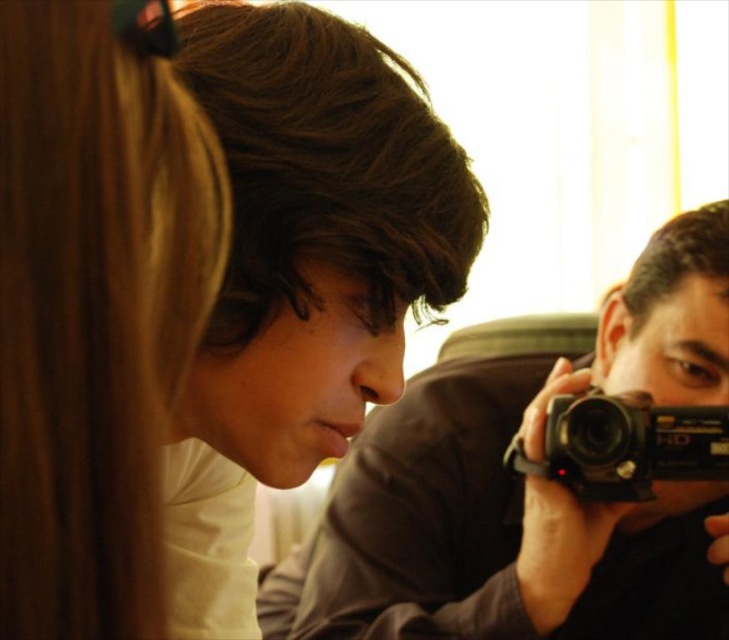
You are standing in the scene and want to hand the matte black camera at center to the person with long, straight brown hair. Can you directly hand it to them without moving the camera from its current position?

The matte black camera at center is located at point (534, 486), so yes, you can directly hand it to the person with long, straight brown hair as the camera is already positioned near them.

Consider the image. You are a photographer at the event and want to ensure both the smooth blonde hair at upper left and the smooth brown hair at center are visible in your wide shot. Based on their spatial relationship, which one might require less adjustment in the frame?

The smooth blonde hair at upper left might require less adjustment in the frame because it occupies less space than the smooth brown hair at center, making it easier to fit within the composition without needing significant repositioning.

You are a photographer trying to capture a candid shot of the person with smooth brown hair at center and the black plastic camera at right. Based on their positions, which object should you focus on first to ensure both are in frame?

The smooth brown hair at center is closer to the viewer than the black plastic camera at right, so you should focus on the smooth brown hair at center first to ensure both are in frame.